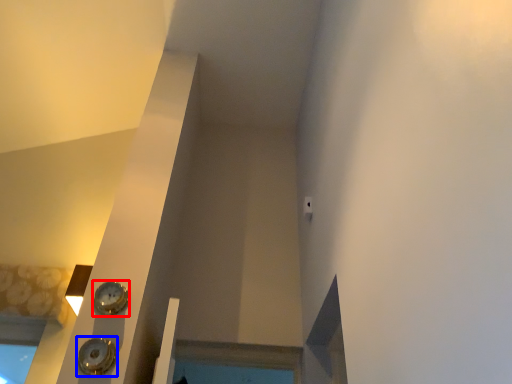
Question: Which object appears farthest to the camera in this image, clock (highlighted by a red box) or clock (highlighted by a blue box)?

Choices:
 (A) clock
 (B) clock

Answer: (A)